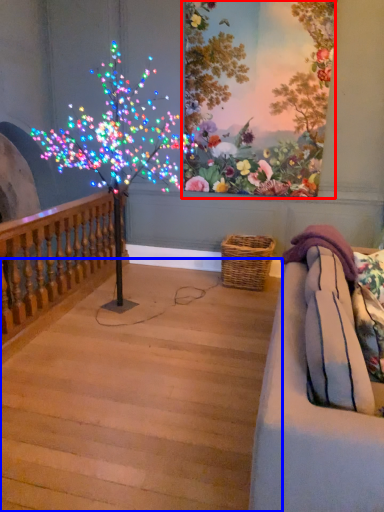
Question: Which point is closer to the camera, floral arrangement (highlighted by a red box) or stairwell (highlighted by a blue box)?

Choices:
 (A) floral arrangement
 (B) stairwell

Answer: (B)